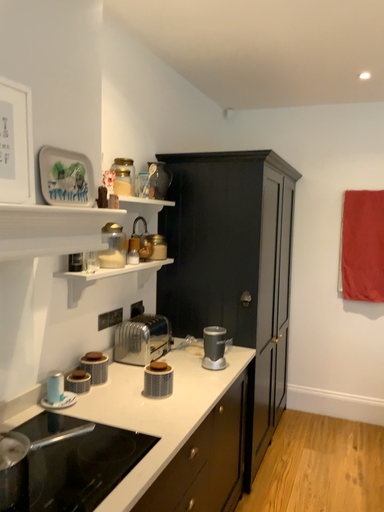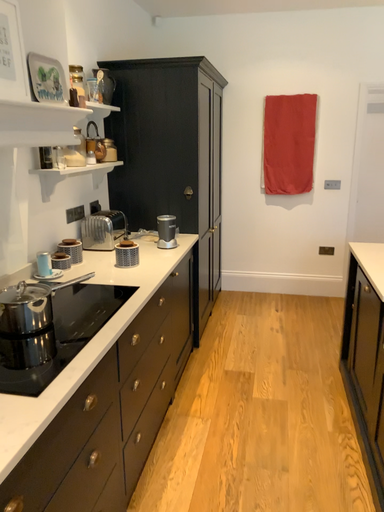
Question: How did the camera likely rotate when shooting the video?

Choices:
 (A) rotated right
 (B) rotated left

Answer: (A)